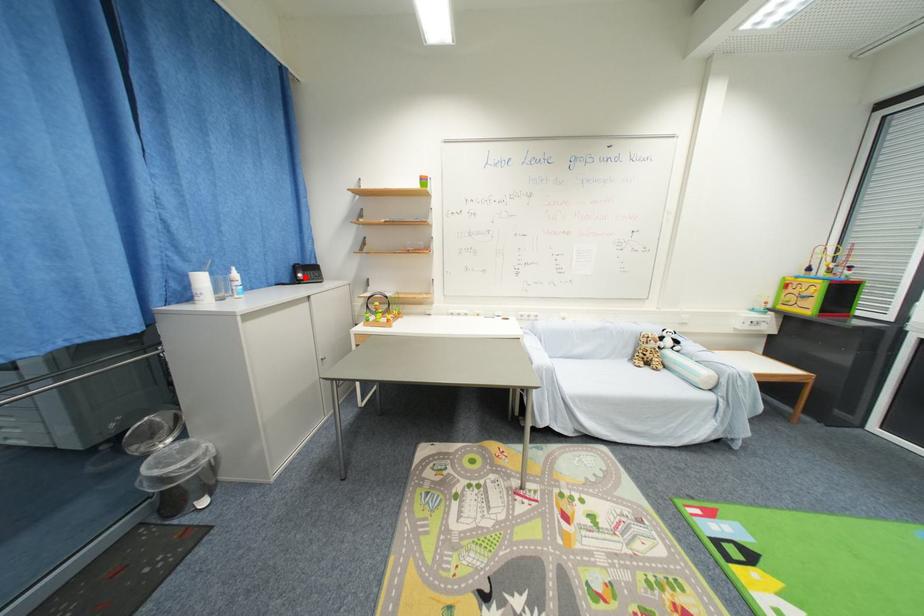
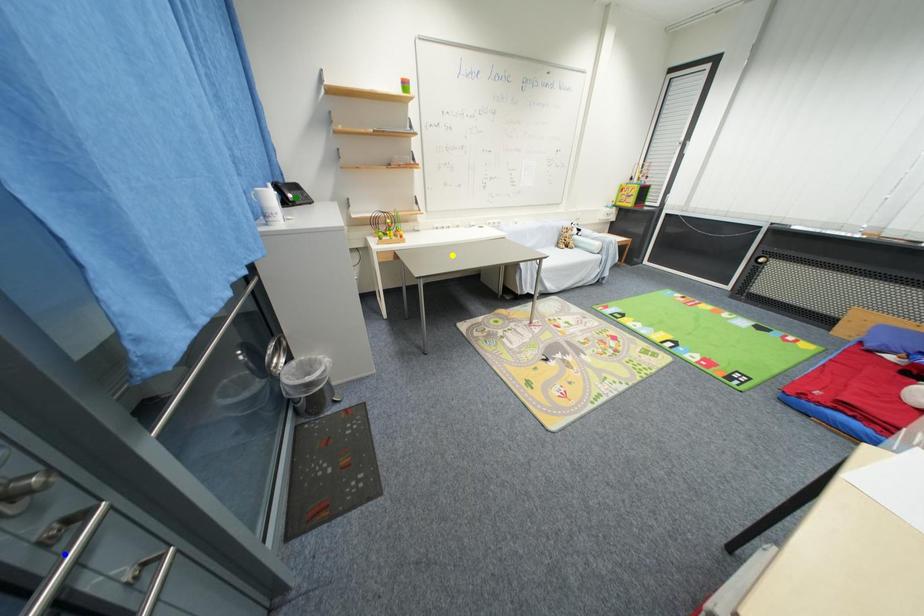
Question: I am providing you with two images of the same scene from different viewpoints. A red point is marked on the first image. You are given multiple points on the second image. Can you choose the point in image 2 that corresponds to the point in image 1?

Choices:
 (A) blue point
 (B) yellow point
 (C) green point

Answer: (C)